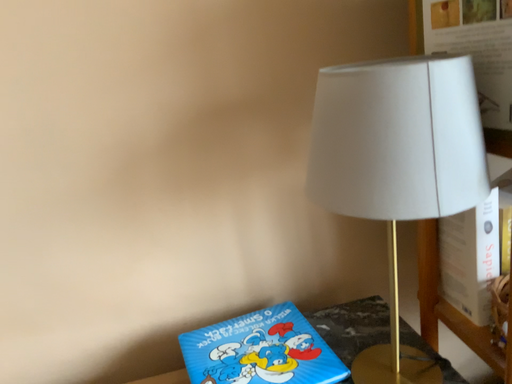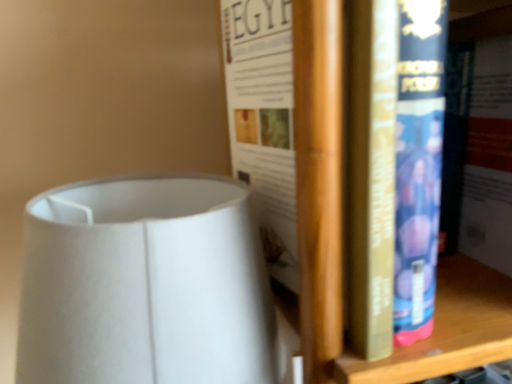
Question: Which way did the camera rotate in the video?

Choices:
 (A) rotated right
 (B) rotated left

Answer: (A)